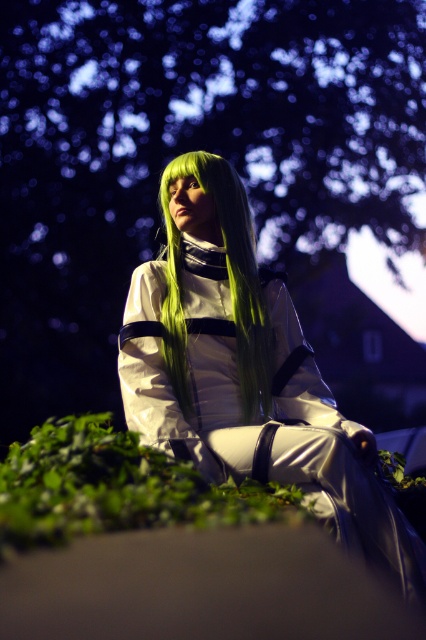
You are a photographer adjusting your camera settings to capture the scene. You notice the green leafy tree at upper center and the satin green wig at center. Which object should you focus on first if you want to ensure both are in sharp focus?

The green leafy tree at upper center is above the satin green wig at center, so focusing on the tree first would help ensure both are in focus as it is farther away and adjusting focus from far to near can help achieve sharpness for both.

You are an alien botanist observing this scene. You notice the green leafy tree at upper center and the green silky wig at center. Which object is positioned to the left of the other?

The green leafy tree at upper center is to the left of the green silky wig at center.

You are a photographer trying to capture the scene with a camera. The green leafy tree at upper center and the green silky wig at center are both in your frame. Which object would you need to adjust your focus on to ensure it appears larger in the photo?

The green leafy tree at upper center would appear larger in the photo because its width is larger than the green silky wig at center.